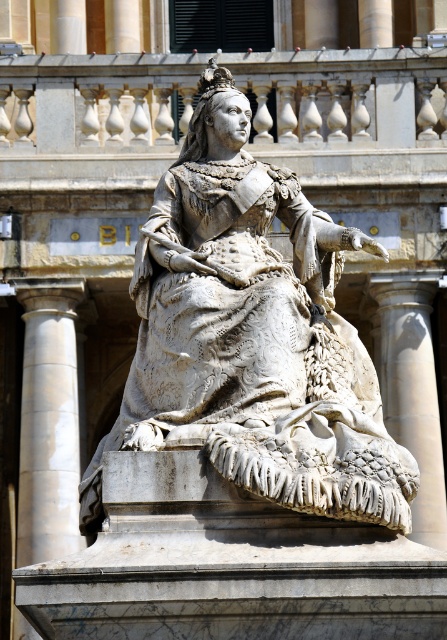
You are an art student standing in front of the white marble statue at center and the white marble column at right. Which object is closer to you?

The white marble statue at center is closer to you than the white marble column at right.

You are an art student standing in front of the white marble statue at center and the white marble column at left. Which object is positioned to the right of the other?

The white marble statue at center is to the right of the white marble column at left.